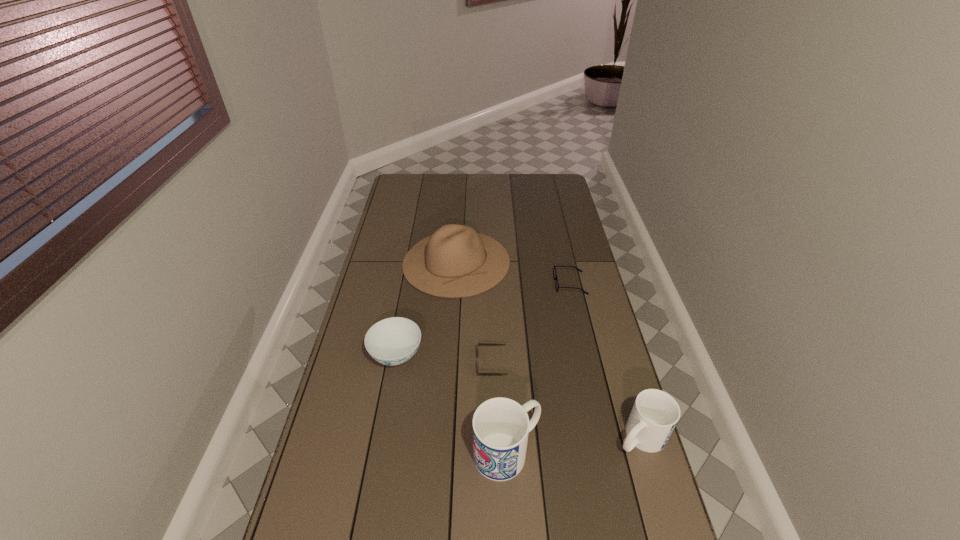
Image resolution: width=960 pixels, height=540 pixels. I want to click on blank area located 0.210m on the front of the chinaware, so (x=381, y=439).

You are a GUI agent. You are given a task and a screenshot of the screen. Output one action in this format:
    pyautogui.click(x=<x>, y=<y>)
    Task: Click on the vacant space situated 0.110m on the front-facing side of the spectacles
    The image size is (960, 540).
    Given the screenshot: What is the action you would take?
    pyautogui.click(x=527, y=284)

At what (x,y) coordinates should I click in order to perform the action: click on free space located 0.140m on the front-facing side of the spectacles. Please return your answer as a coordinate pair (x, y). The height and width of the screenshot is (540, 960). Looking at the image, I should click on tap(519, 284).

Where is `vacant space located on the front-facing side of the spectacles`? This screenshot has width=960, height=540. vacant space located on the front-facing side of the spectacles is located at coordinates (471, 284).

Locate an element on the screen. The image size is (960, 540). blank space located 0.140m on the front-facing side of the sunglasses is located at coordinates (435, 363).

At what (x,y) coordinates should I click in order to perform the action: click on vacant space positioned on the front-facing side of the sunglasses. Please return your answer as a coordinate pair (x, y). This screenshot has height=540, width=960. Looking at the image, I should click on (414, 363).

Locate an element on the screen. This screenshot has height=540, width=960. free region located 0.400m on the front-facing side of the sunglasses is located at coordinates (356, 363).

Locate an element on the screen. sombrero situated at the left edge is located at coordinates (455, 261).

Locate an element on the screen. The height and width of the screenshot is (540, 960). chinaware that is at the left edge is located at coordinates [x=393, y=341].

Where is `mug that is at the right edge`? mug that is at the right edge is located at coordinates (654, 415).